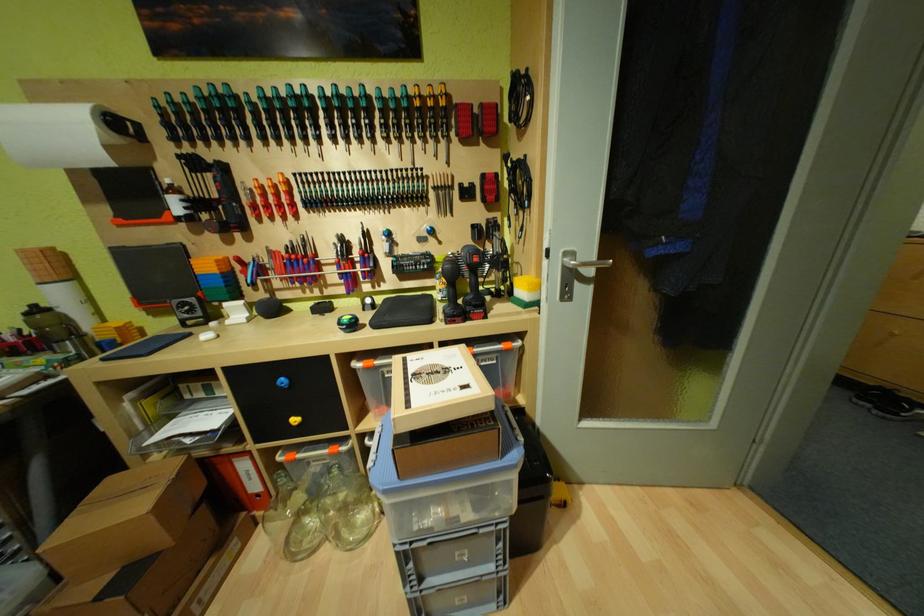
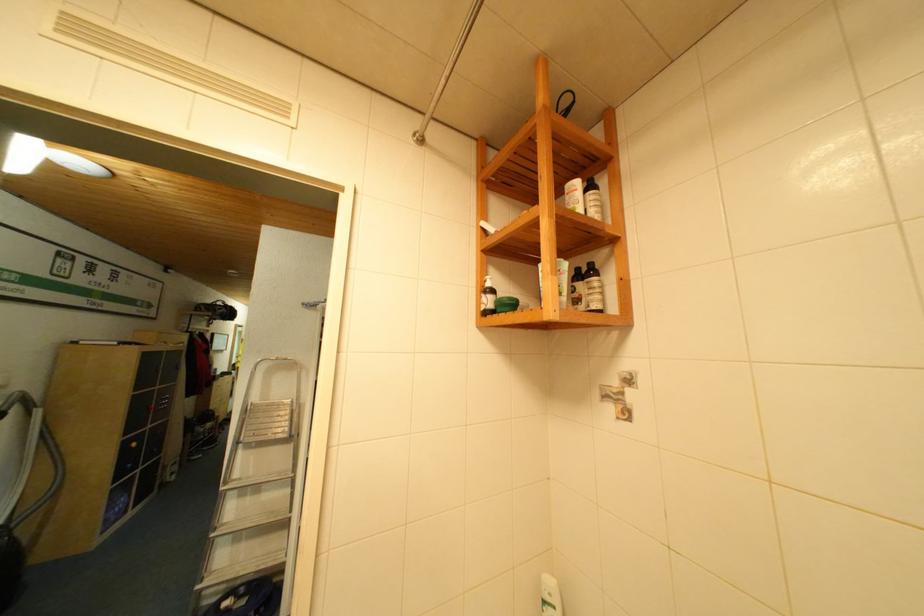
Question: I am providing you with two images of the same scene from different viewpoints. After the viewpoint changes to image2, which objects are now occluded?

Choices:
 (A) barbell bar
 (B) green screwdriver handle
 (C) metal step ladder
 (D) white pump bottle

Answer: (B)